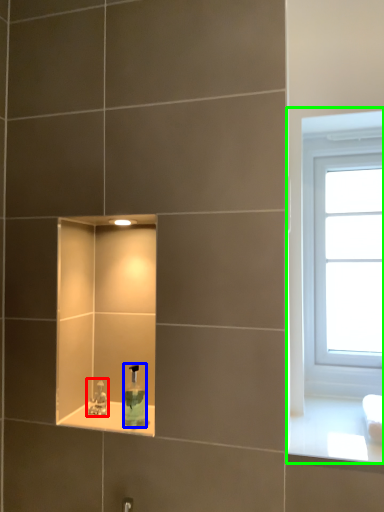
Question: Which object is positioned closest to tap (highlighted by a red box)? Select from soap dispenser (highlighted by a blue box) and window (highlighted by a green box).

Choices:
 (A) soap dispenser
 (B) window

Answer: (A)